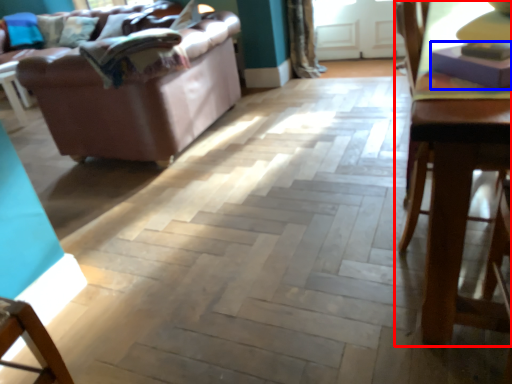
Question: Which point is closer to the camera, table (highlighted by a red box) or book (highlighted by a blue box)?

Choices:
 (A) table
 (B) book

Answer: (A)